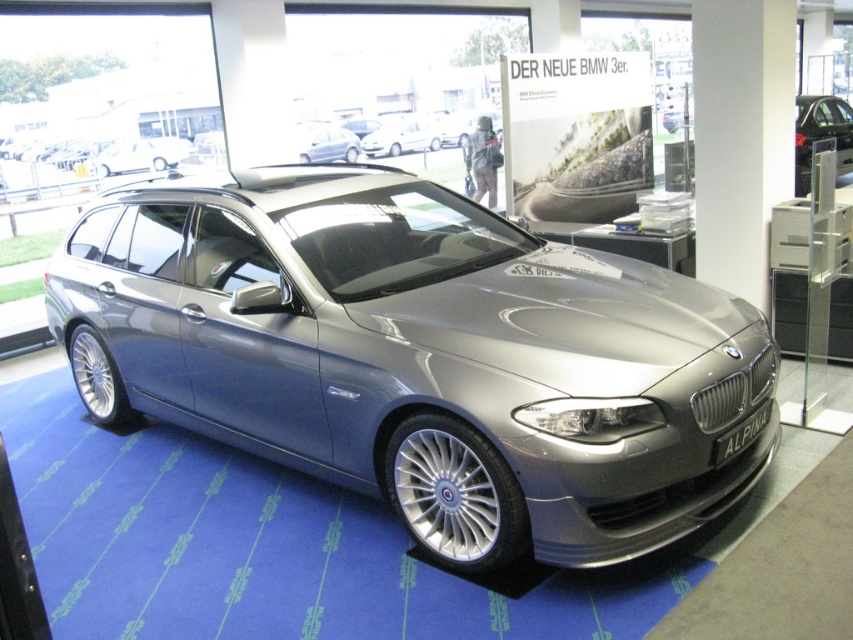
In the scene shown: Who is positioned more to the left, satin silver car at upper right or satin silver metallic car at upper center?

From the viewer's perspective, satin silver metallic car at upper center appears more on the left side.

Locate an element on the screen. The image size is (853, 640). satin silver car at upper right is located at coordinates (821, 124).

Locate an element on the screen. This screenshot has height=640, width=853. satin silver car at upper right is located at coordinates (821, 124).

Consider the image. Is white glossy hatchback at center taller than satin silver metallic car at upper center?

Yes.

Between white glossy hatchback at center and satin silver metallic car at upper center, which one is positioned lower?

satin silver metallic car at upper center is lower down.

Who is more distant from viewer, (374, 156) or (302, 150)?

The point (374, 156) is more distant.

You are a GUI agent. You are given a task and a screenshot of the screen. Output one action in this format:
    pyautogui.click(x=<x>, y=<y>)
    Task: Click on the white glossy hatchback at center
    Image resolution: width=853 pixels, height=640 pixels.
    Given the screenshot: What is the action you would take?
    pyautogui.click(x=403, y=134)

Does blue carpet at center appear under satin silver car at upper right?

Indeed, blue carpet at center is positioned under satin silver car at upper right.

Can you confirm if blue carpet at center is positioned above satin silver car at upper right?

No.

Locate an element on the screen. Image resolution: width=853 pixels, height=640 pixels. blue carpet at center is located at coordinates point(265,547).

Where is `blue carpet at center`? The height and width of the screenshot is (640, 853). blue carpet at center is located at coordinates (265, 547).